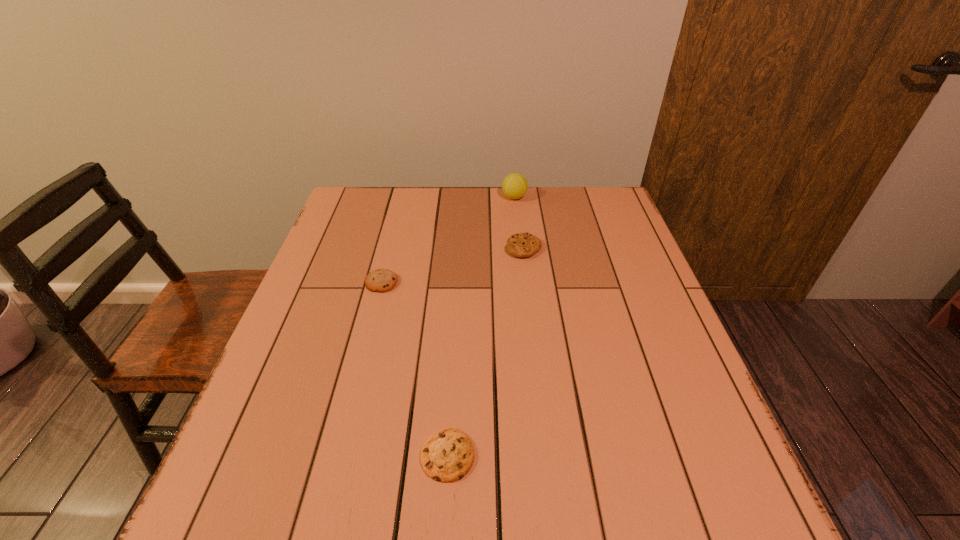
Locate an element on the screen. vacant region located 0.340m on the front of the second shortest cookie is located at coordinates (348, 414).

Identify the location of vacant area situated 0.300m on the left of the nearest object. The image size is (960, 540). (252, 455).

Identify the location of object at the far edge. (514, 186).

This screenshot has height=540, width=960. Identify the location of object that is at the left edge. (381, 280).

Where is `vacant space at the far edge of the desktop`? vacant space at the far edge of the desktop is located at coordinates (532, 221).

In the image, there is a desktop. Identify the location of free space at the near edge. (550, 502).

You are a GUI agent. You are given a task and a screenshot of the screen. Output one action in this format:
    pyautogui.click(x=<x>, y=<y>)
    Task: Click on the vacant space at the left edge of the desktop
    The height and width of the screenshot is (540, 960).
    Given the screenshot: What is the action you would take?
    pyautogui.click(x=296, y=305)

In the image, there is a desktop. Identify the location of vacant space at the right edge. The height and width of the screenshot is (540, 960). (642, 412).

At what (x,y) coordinates should I click in order to perform the action: click on free region at the far left corner of the desktop. Please return your answer as a coordinate pair (x, y). Looking at the image, I should click on (362, 195).

Where is `free region at the near left corner`? The image size is (960, 540). free region at the near left corner is located at coordinates (291, 498).